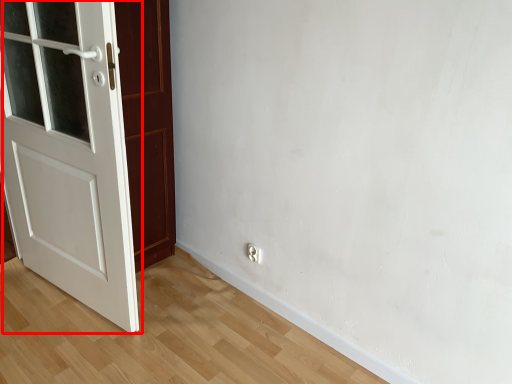
Question: From the image's perspective, where is door (annotated by the red box) located relative to electric outlet?

Choices:
 (A) below
 (B) above

Answer: (B)